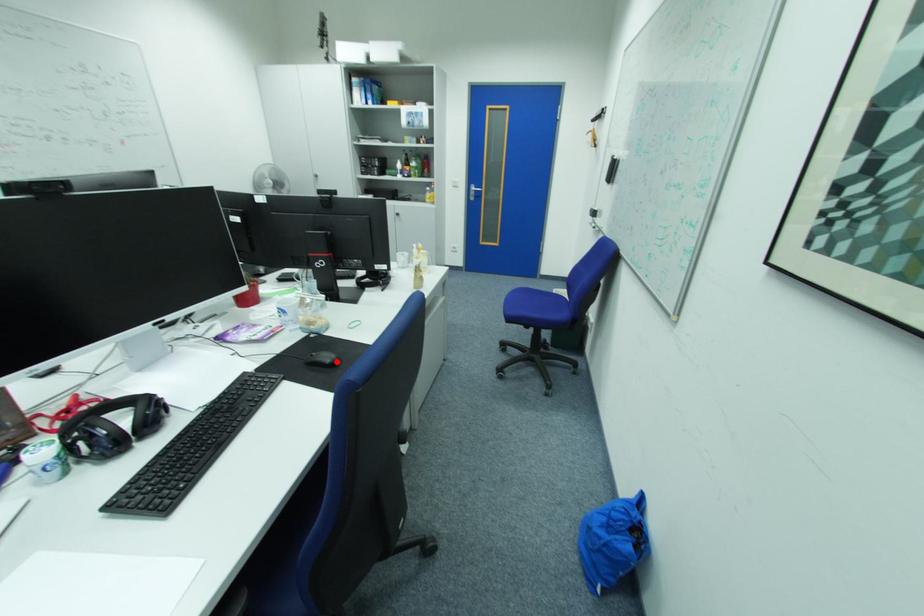
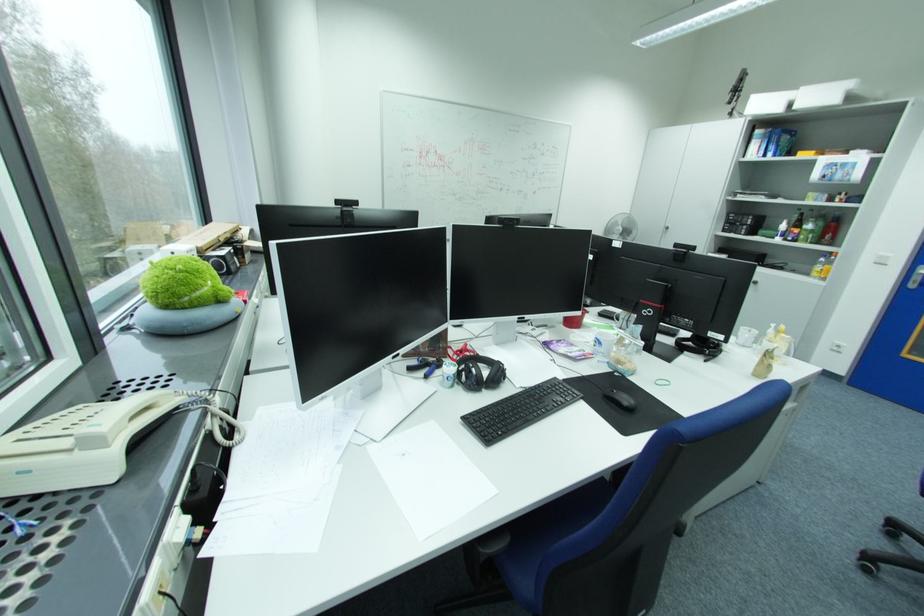
Locate, in the second image, the point that corresponds to the highlighted location in the first image.

(635, 405)